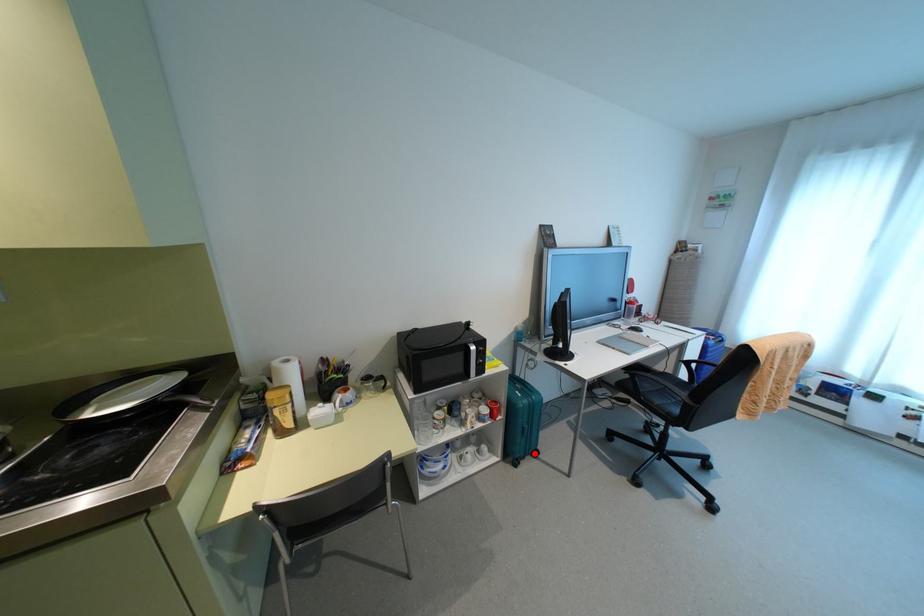
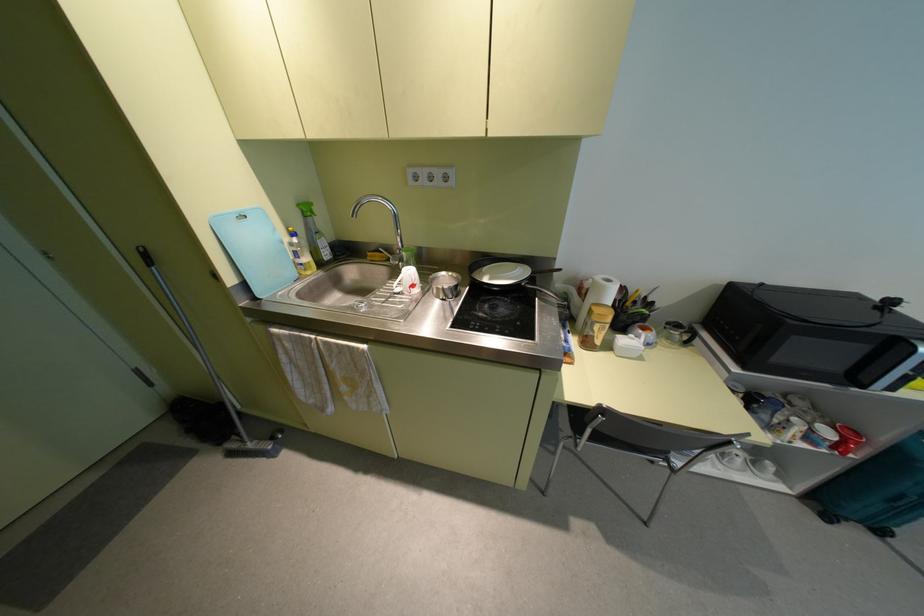
Where in the second image is the point corresponding to the highlighted location from the first image?

(880, 531)